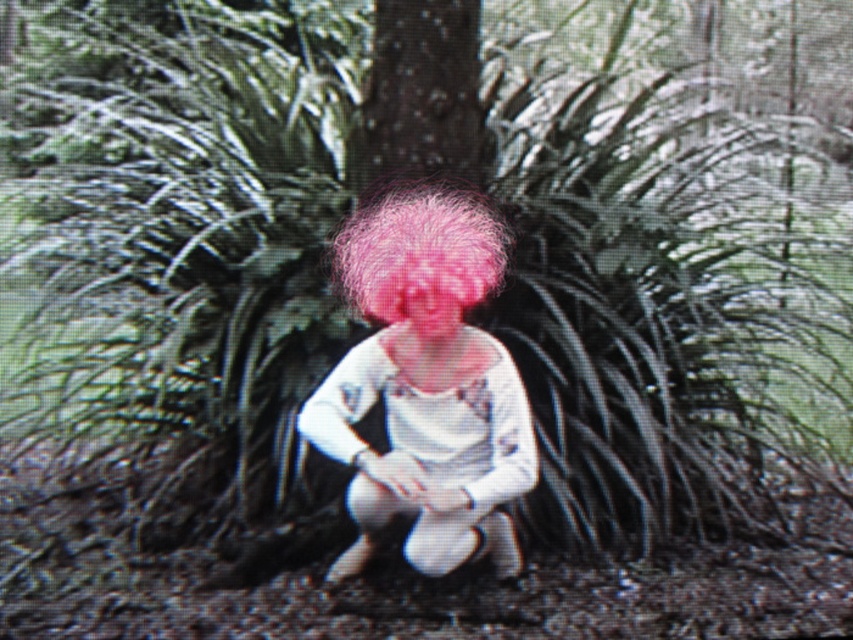
Question: Observing the image, what is the correct spatial positioning of smooth bark tree trunk at center in reference to fuzzy pink hair at center?

Choices:
 (A) above
 (B) below

Answer: (A)

Question: Considering the relative positions of fuzzy pink wig at center and smooth bark tree trunk at center in the image provided, where is fuzzy pink wig at center located with respect to smooth bark tree trunk at center?

Choices:
 (A) right
 (B) left

Answer: (A)

Question: Which object appears closest to the camera in this image?

Choices:
 (A) fuzzy pink wig at center
 (B) smooth bark tree trunk at center
 (C) fuzzy pink hair at center

Answer: (A)

Question: Which of the following is the closest to the observer?

Choices:
 (A) smooth bark tree trunk at center
 (B) fuzzy pink wig at center

Answer: (B)

Question: Does fuzzy pink wig at center have a lesser width compared to fuzzy pink hair at center?

Choices:
 (A) no
 (B) yes

Answer: (A)

Question: Which point is closer to the camera taking this photo?

Choices:
 (A) (439, 300)
 (B) (491, 468)
 (C) (341, 282)

Answer: (A)